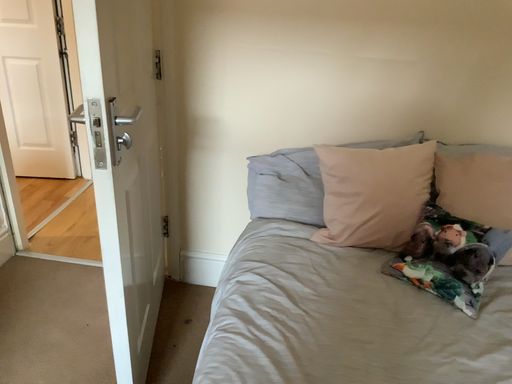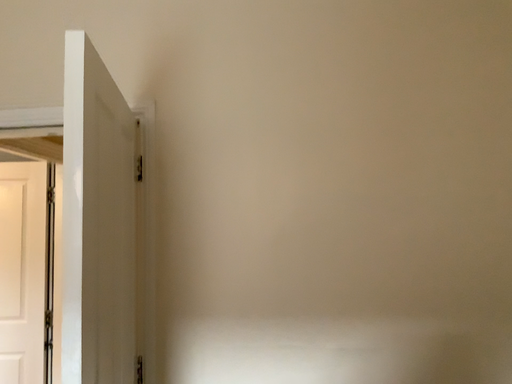
Question: How did the camera likely rotate when shooting the video?

Choices:
 (A) rotated downward
 (B) rotated upward

Answer: (B)